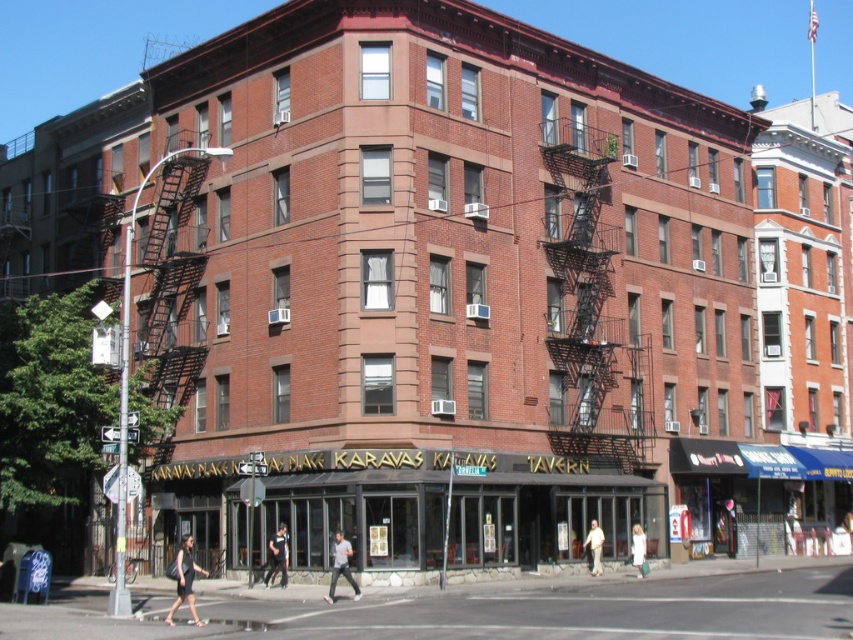
From the picture: Which is more to the left, black metal fire escape at center or white cotton shirt at center?

Positioned to the left is white cotton shirt at center.

Is point (576, 294) less distant than point (592, 538)?

No, it is not.

What do you see at coordinates (589, 301) in the screenshot?
I see `black metal fire escape at center` at bounding box center [589, 301].

Where is `black metal fire escape at center`? This screenshot has height=640, width=853. black metal fire escape at center is located at coordinates (589, 301).

Is black dress at center closer to the viewer compared to white cotton shirt at center?

Yes, it is in front of white cotton shirt at center.

Describe the element at coordinates (184, 580) in the screenshot. This screenshot has width=853, height=640. I see `black dress at center` at that location.

Is point (195, 620) closer to camera compared to point (596, 570)?

Yes.

Identify the location of black dress at center. (184, 580).

The image size is (853, 640). In order to click on black metal fire escape at center in this screenshot , I will do `click(589, 301)`.

Does black metal fire escape at center appear on the right side of white cotton dress at center?

Incorrect, black metal fire escape at center is not on the right side of white cotton dress at center.

Is point (602, 202) positioned before point (640, 563)?

No, (602, 202) is further to viewer.

Find the location of a particular element. The width and height of the screenshot is (853, 640). black metal fire escape at center is located at coordinates click(589, 301).